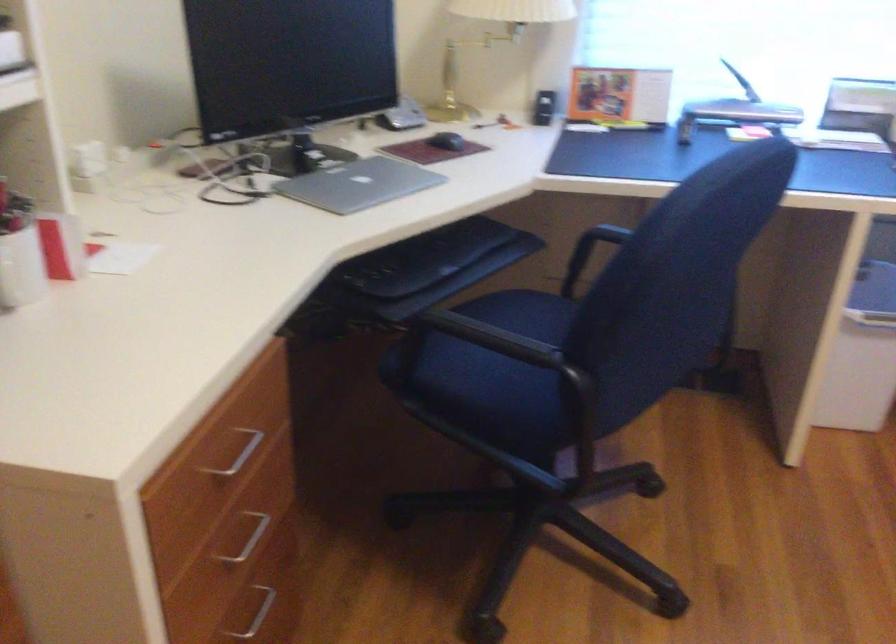
Image resolution: width=896 pixels, height=644 pixels. In order to click on silver laptop in this screenshot , I will do `click(358, 184)`.